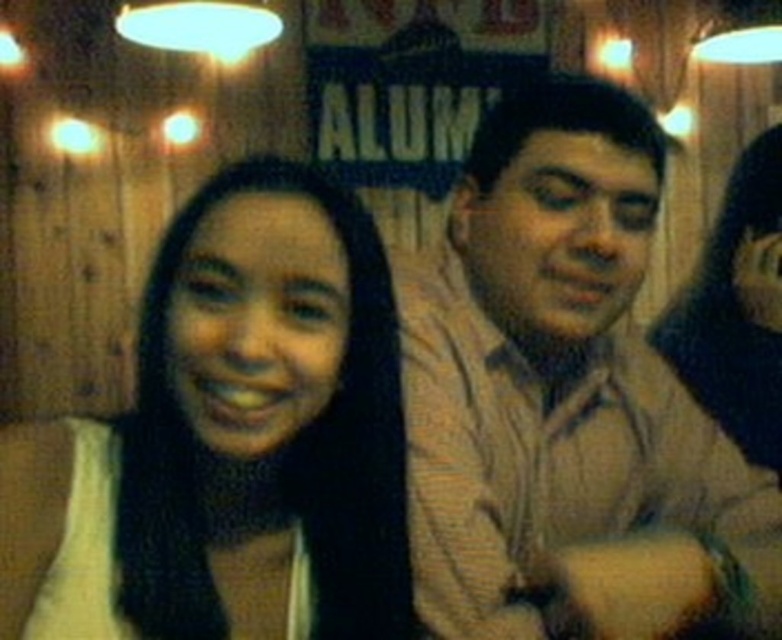
Is light brown shirt at right thinner than dark brown hair at center?

No, light brown shirt at right is not thinner than dark brown hair at center.

Can you confirm if light brown shirt at right is positioned above dark brown hair at center?

Indeed, light brown shirt at right is positioned over dark brown hair at center.

Is point (562, 368) less distant than point (359, 634)?

No, (562, 368) is further to viewer.

Find the location of a particular element. light brown shirt at right is located at coordinates (569, 403).